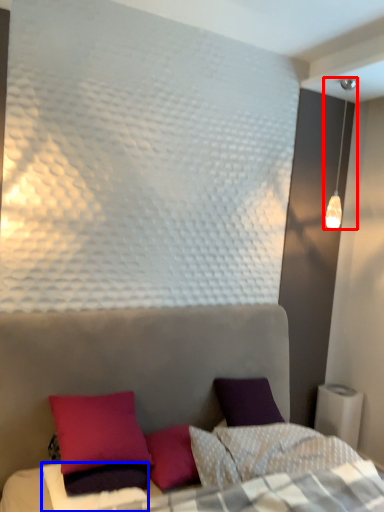
Question: Which of the following is the farthest to the observer, lamp (highlighted by a red box) or sheet (highlighted by a blue box)?

Choices:
 (A) lamp
 (B) sheet

Answer: (A)